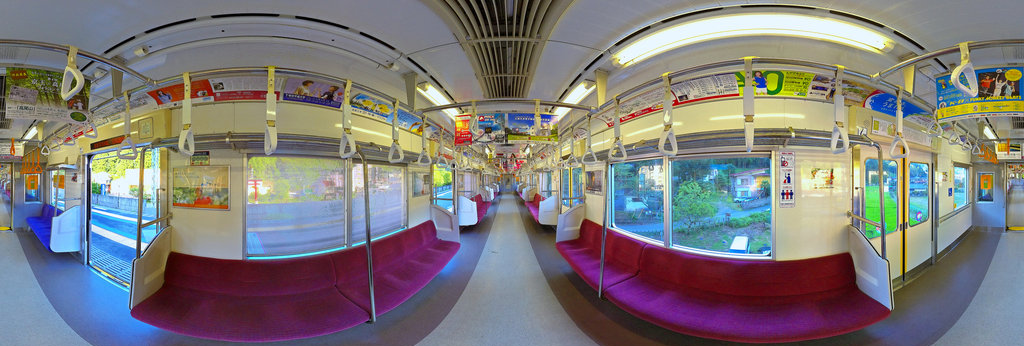
Find the location of a particular element. The width and height of the screenshot is (1024, 346). ceiling is located at coordinates (389, 23).